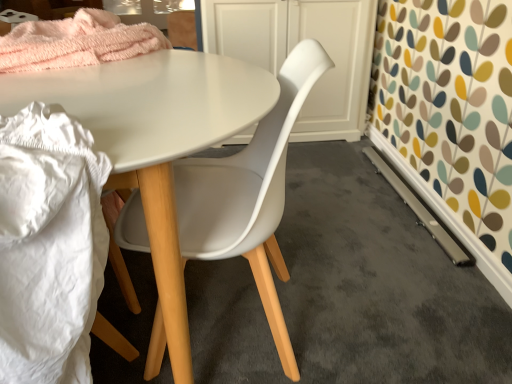
Question: Is white fabric at lower left oriented towards white plastic chair at center?

Choices:
 (A) no
 (B) yes

Answer: (A)

Question: Is white plastic chair at center located within white fabric at lower left?

Choices:
 (A) no
 (B) yes

Answer: (A)

Question: Does white fabric at lower left have a smaller size compared to white plastic chair at center?

Choices:
 (A) no
 (B) yes

Answer: (B)

Question: Does white fabric at lower left appear on the right side of white plastic chair at center?

Choices:
 (A) yes
 (B) no

Answer: (B)

Question: Can you confirm if white fabric at lower left is shorter than white plastic chair at center?

Choices:
 (A) no
 (B) yes

Answer: (B)

Question: Is white fabric at lower left positioned beyond the bounds of white plastic chair at center?

Choices:
 (A) yes
 (B) no

Answer: (A)

Question: Is white fabric at lower left facing away from white matte cabinet at center?

Choices:
 (A) no
 (B) yes

Answer: (A)

Question: From a real-world perspective, is white fabric at lower left located higher than white matte cabinet at center?

Choices:
 (A) no
 (B) yes

Answer: (B)

Question: Are white fabric at lower left and white matte cabinet at center located far from each other?

Choices:
 (A) yes
 (B) no

Answer: (A)

Question: From the image's perspective, would you say white fabric at lower left is positioned over white matte cabinet at center?

Choices:
 (A) yes
 (B) no

Answer: (B)

Question: From the image's perspective, is white fabric at lower left below white matte cabinet at center?

Choices:
 (A) yes
 (B) no

Answer: (A)

Question: Does white fabric at lower left have a lesser width compared to white matte cabinet at center?

Choices:
 (A) no
 (B) yes

Answer: (A)

Question: From a real-world perspective, is white plastic chair at center located higher than white matte cabinet at center?

Choices:
 (A) yes
 (B) no

Answer: (A)